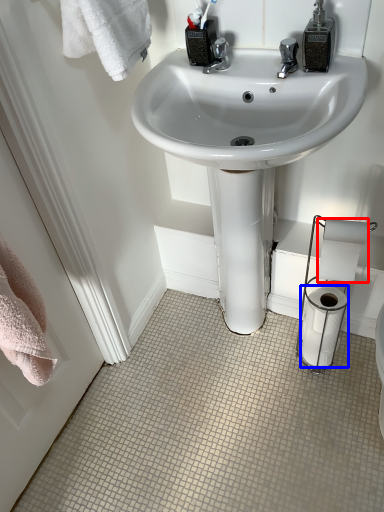
Question: Which object appears farthest to the camera in this image, toilet paper (highlighted by a red box) or toilet paper (highlighted by a blue box)?

Choices:
 (A) toilet paper
 (B) toilet paper

Answer: (B)